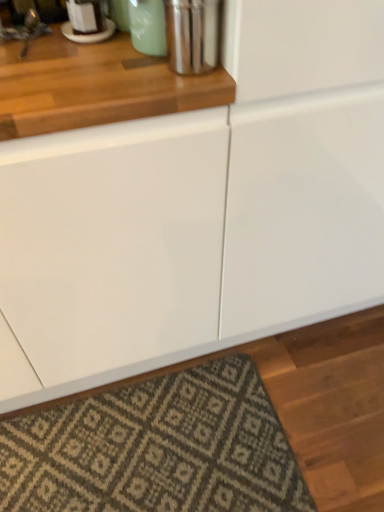
Find the location of a particular element. This screenshot has height=512, width=384. textured beige rug at lower center is located at coordinates (156, 448).

Image resolution: width=384 pixels, height=512 pixels. What do you see at coordinates (156, 448) in the screenshot?
I see `textured beige rug at lower center` at bounding box center [156, 448].

Measure the distance between shiny metallic canister at upper center and camera.

64.65 centimeters.

You are a GUI agent. You are given a task and a screenshot of the screen. Output one action in this format:
    pyautogui.click(x=<x>, y=<y>)
    Task: Click on the shiny metallic canister at upper center
    The width and height of the screenshot is (384, 512).
    Given the screenshot: What is the action you would take?
    192,35

The height and width of the screenshot is (512, 384). What do you see at coordinates (192, 35) in the screenshot?
I see `shiny metallic canister at upper center` at bounding box center [192, 35].

Identify the location of textured beige rug at lower center. Image resolution: width=384 pixels, height=512 pixels. (156, 448).

Looking at this image, considering the positions of objects textured beige rug at lower center and shiny metallic canister at upper center in the image provided, who is more to the left, textured beige rug at lower center or shiny metallic canister at upper center?

From the viewer's perspective, textured beige rug at lower center appears more on the left side.

Considering the relative positions of textured beige rug at lower center and shiny metallic canister at upper center in the image provided, is textured beige rug at lower center in front of shiny metallic canister at upper center?

No, it is behind shiny metallic canister at upper center.

Is point (134, 399) positioned before point (211, 6)?

No, it is not.

From the image's perspective, is textured beige rug at lower center located above or below shiny metallic canister at upper center?

From the image's perspective, textured beige rug at lower center appears below shiny metallic canister at upper center.

From a real-world perspective, between textured beige rug at lower center and shiny metallic canister at upper center, who is vertically lower?

textured beige rug at lower center, from a real-world perspective.

Which object is wider, textured beige rug at lower center or shiny metallic canister at upper center?

Wider between the two is textured beige rug at lower center.

Does textured beige rug at lower center have a lesser height compared to shiny metallic canister at upper center?

Yes, textured beige rug at lower center is shorter than shiny metallic canister at upper center.

Consider the image. Considering the sizes of objects textured beige rug at lower center and shiny metallic canister at upper center in the image provided, who is bigger, textured beige rug at lower center or shiny metallic canister at upper center?

textured beige rug at lower center.

Would you say shiny metallic canister at upper center is part of textured beige rug at lower center's contents?

That's incorrect, shiny metallic canister at upper center is not inside textured beige rug at lower center.

Would you say textured beige rug at lower center is a long distance from shiny metallic canister at upper center?

That's not correct — textured beige rug at lower center is a little close to shiny metallic canister at upper center.

Is textured beige rug at lower center facing away from shiny metallic canister at upper center?

No, textured beige rug at lower center's orientation is not away from shiny metallic canister at upper center.

Identify the location of mat that is on the left side of shiny metallic canister at upper center. (156, 448).

Considering the positions of objects shiny metallic canister at upper center and textured beige rug at lower center in the image provided, who is more to the left, shiny metallic canister at upper center or textured beige rug at lower center?

Positioned to the left is textured beige rug at lower center.

Does shiny metallic canister at upper center lie in front of textured beige rug at lower center?

Yes, the depth of shiny metallic canister at upper center is less than that of textured beige rug at lower center.

Which is closer, (174, 49) or (189, 488)?

Point (174, 49)

From the image's perspective, is shiny metallic canister at upper center positioned above or below textured beige rug at lower center?

Clearly, from the image's perspective, shiny metallic canister at upper center is above textured beige rug at lower center.

From a real-world perspective, which is physically below, shiny metallic canister at upper center or textured beige rug at lower center?

textured beige rug at lower center, from a real-world perspective.

In terms of width, does shiny metallic canister at upper center look wider or thinner when compared to textured beige rug at lower center?

Considering their sizes, shiny metallic canister at upper center looks slimmer than textured beige rug at lower center.

From their relative heights in the image, would you say shiny metallic canister at upper center is taller or shorter than textured beige rug at lower center?

Clearly, shiny metallic canister at upper center is taller compared to textured beige rug at lower center.

Consider the image. Looking at the image, does shiny metallic canister at upper center seem bigger or smaller compared to textured beige rug at lower center?

shiny metallic canister at upper center is smaller than textured beige rug at lower center.

Is shiny metallic canister at upper center surrounding textured beige rug at lower center?

No, textured beige rug at lower center is not a part of shiny metallic canister at upper center.

Is shiny metallic canister at upper center next to textured beige rug at lower center and touching it?

shiny metallic canister at upper center is not next to textured beige rug at lower center, and they're not touching.

Could you tell me if shiny metallic canister at upper center is facing textured beige rug at lower center?

No.

What's the angular difference between shiny metallic canister at upper center and textured beige rug at lower center's facing directions?

shiny metallic canister at upper center and textured beige rug at lower center are facing 4.43 degrees away from each other.

Locate an element on the screen. appliance on the right side of textured beige rug at lower center is located at coordinates (192, 35).

Find the location of `mat to the left of shiny metallic canister at upper center`. mat to the left of shiny metallic canister at upper center is located at coordinates (156, 448).

At what (x,y) coordinates should I click in order to perform the action: click on mat that is under the shiny metallic canister at upper center (from a real-world perspective). Please return your answer as a coordinate pair (x, y). The width and height of the screenshot is (384, 512). Looking at the image, I should click on (156, 448).